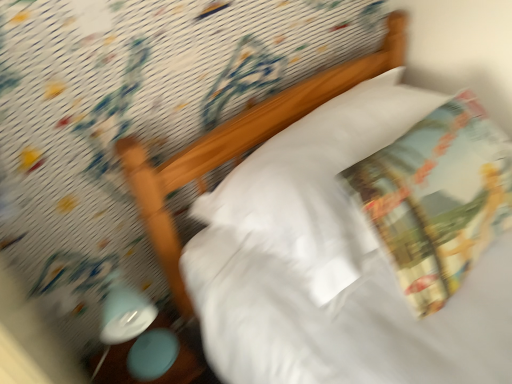
Question: Does point (122, 281) appear closer or farther from the camera than point (186, 342)?

Choices:
 (A) farther
 (B) closer

Answer: (A)

Question: Considering the relative positions of matte blue lamp at lower left and matte plastic table at lower left in the image provided, is matte blue lamp at lower left to the left or to the right of matte plastic table at lower left?

Choices:
 (A) left
 (B) right

Answer: (A)

Question: Which is nearer to the printed fabric throw pillow at upper right?

Choices:
 (A) white soft pillow at upper center
 (B) matte plastic table at lower left
 (C) matte blue lamp at lower left

Answer: (A)

Question: Based on their relative distances, which object is farther from the white soft pillow at upper center?

Choices:
 (A) matte plastic table at lower left
 (B) printed fabric throw pillow at upper right
 (C) matte blue lamp at lower left

Answer: (A)